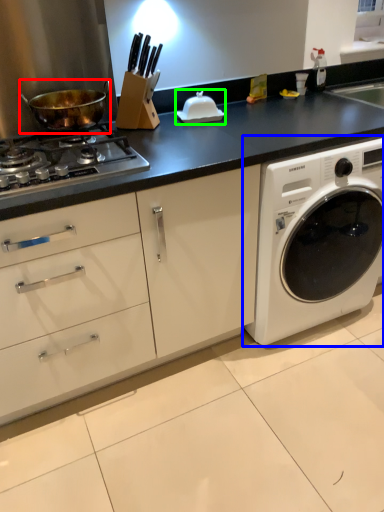
Question: Based on their relative distances, which object is farther from wok (highlighted by a red box)? Choose from washing machine (highlighted by a blue box) and appliance (highlighted by a green box).

Choices:
 (A) washing machine
 (B) appliance

Answer: (A)